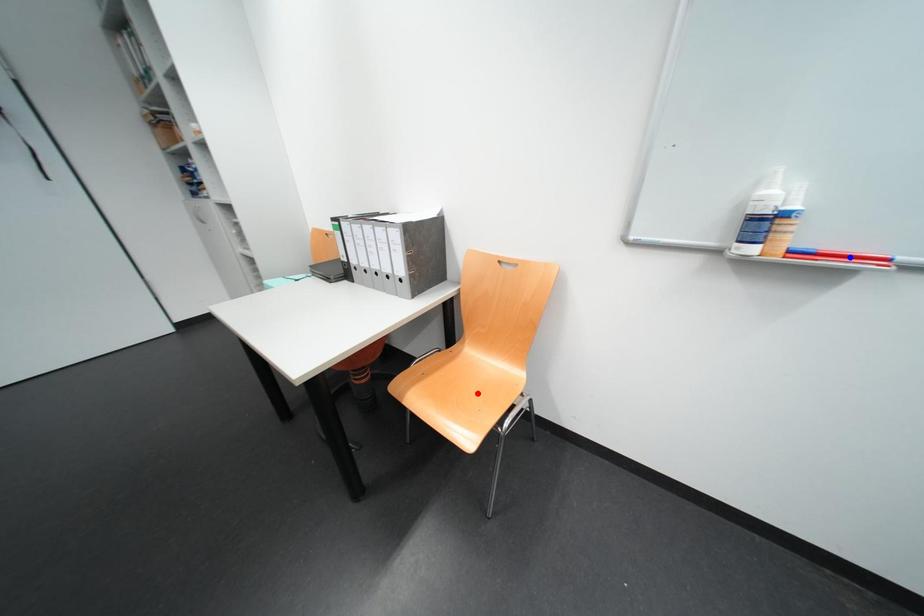
Question: Two points are marked on the image. Which point is closer to the camera?

Choices:
 (A) Blue point is closer.
 (B) Red point is closer.

Answer: (A)